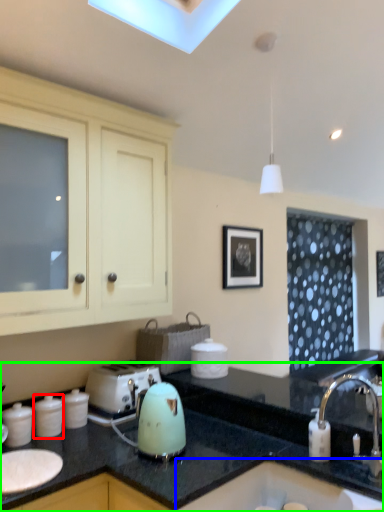
Question: Which object is the closest to the kitchen appliance (highlighted by a red box)? Choose among these: sink (highlighted by a blue box) or countertop (highlighted by a green box).

Choices:
 (A) sink
 (B) countertop

Answer: (B)